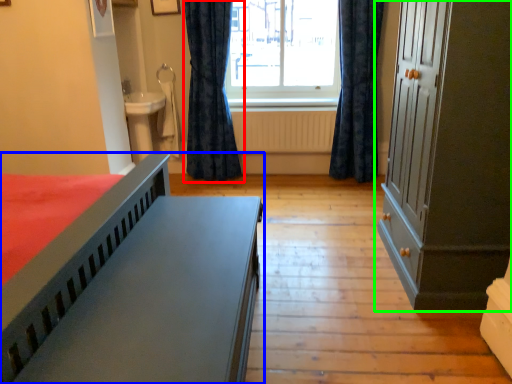
Question: Based on their relative distances, which object is nearer to curtain (highlighted by a red box)? Choose from bed (highlighted by a blue box) and cupboard (highlighted by a green box).

Choices:
 (A) bed
 (B) cupboard

Answer: (B)